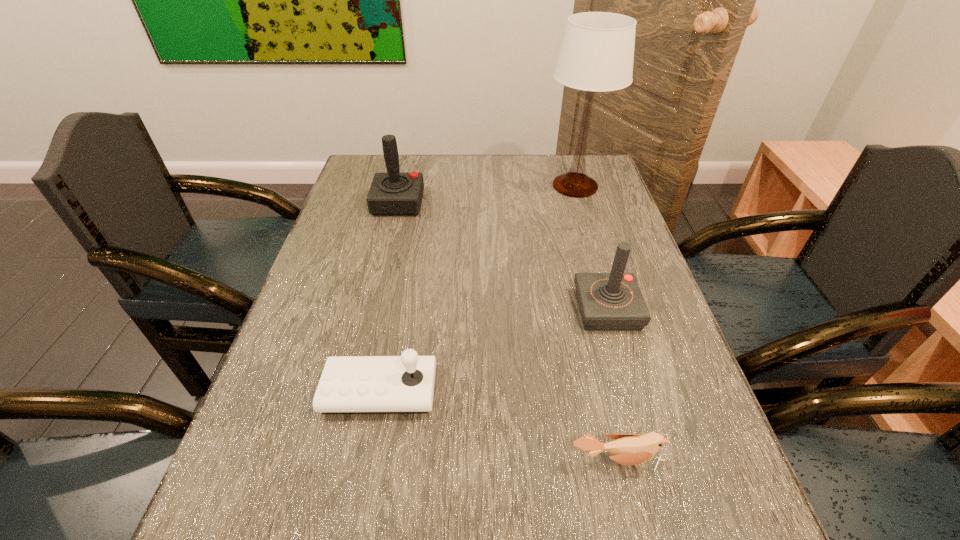
Locate which joystick is the second closest to the bird. Please provide its 2D coordinates. Your answer should be formatted as a tuple, i.e. [(x, y)], where the tuple contains the x and y coordinates of a point satisfying the conditions above.

[(613, 301)]

I want to click on joystick that is the closest to the nearest joystick, so click(613, 301).

Locate an element on the screen. The width and height of the screenshot is (960, 540). vacant space that satisfies the following two spatial constraints: 1. on the rectangular base of the rightmost joystick; 2. on the front side of the second shortest object is located at coordinates (630, 391).

Find the location of a particular element. The image size is (960, 540). vacant point that satisfies the following two spatial constraints: 1. on the rectangular base of the third nearest object; 2. at the beak of the bird is located at coordinates click(x=650, y=461).

At what (x,y) coordinates should I click in order to perform the action: click on free point that satisfies the following two spatial constraints: 1. above the cylindrical shade of the table lamp; 2. at the beak of the shortest object. Please return your answer as a coordinate pair (x, y). Looking at the image, I should click on (657, 461).

Find the location of a particular element. The image size is (960, 540). free point that satisfies the following two spatial constraints: 1. on the base of the fourth tallest object; 2. on the right side of the farthest joystick is located at coordinates (352, 391).